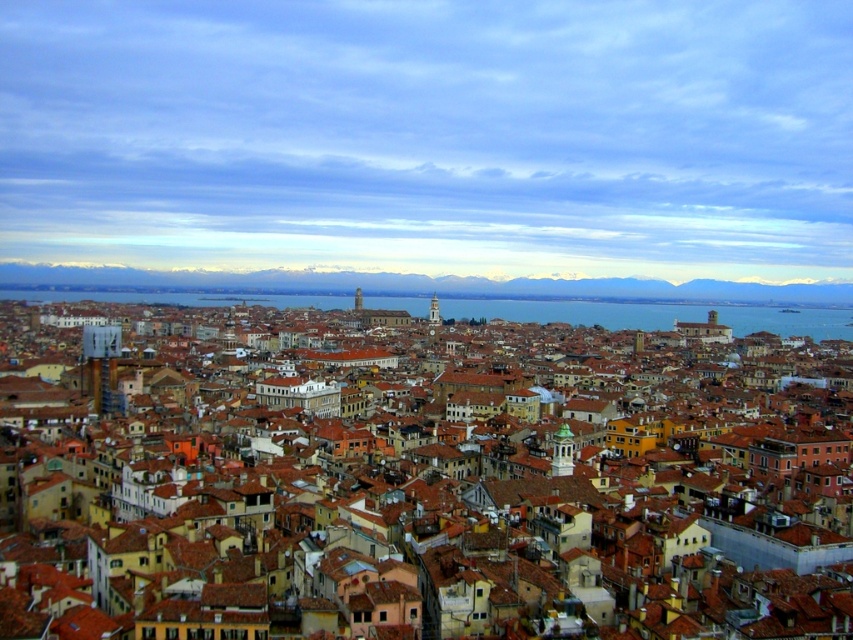
Does brown tiled roofs at center have a lesser width compared to blue water at center?

Indeed, brown tiled roofs at center has a lesser width compared to blue water at center.

Describe the element at coordinates (496, 464) in the screenshot. This screenshot has height=640, width=853. I see `brown tiled roofs at center` at that location.

Who is more forward, (415, 436) or (534, 317)?

Point (415, 436) is more forward.

Locate an element on the screen. Image resolution: width=853 pixels, height=640 pixels. brown tiled roofs at center is located at coordinates (496, 464).